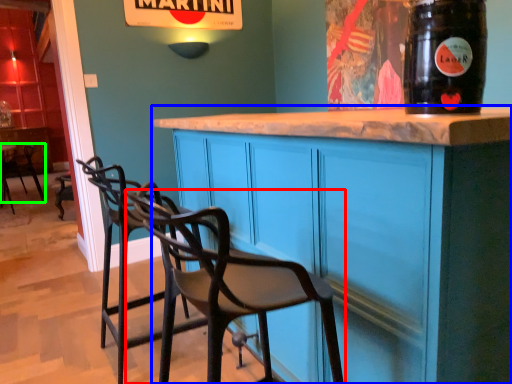
Question: Considering the real-world distances, which object is farthest from chair (highlighted by a red box)? cabinetry (highlighted by a blue box) or chair (highlighted by a green box)?

Choices:
 (A) cabinetry
 (B) chair

Answer: (B)